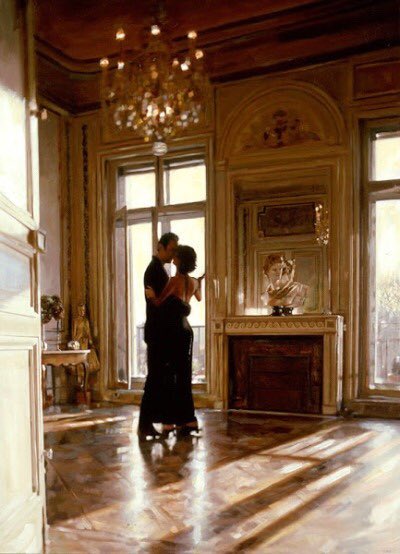
Locate an element on the screen. The height and width of the screenshot is (554, 400). fireplace is located at coordinates (277, 334).